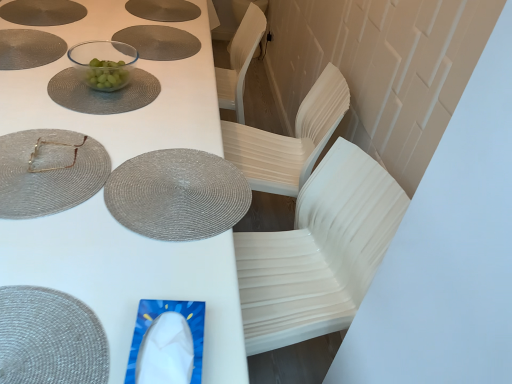
What are the coordinates of `vacant space underneath silver textured placemat at center, marked as the third tableware in a back-to-front arrangement (from a real-world perspective)` in the screenshot? It's located at (176, 185).